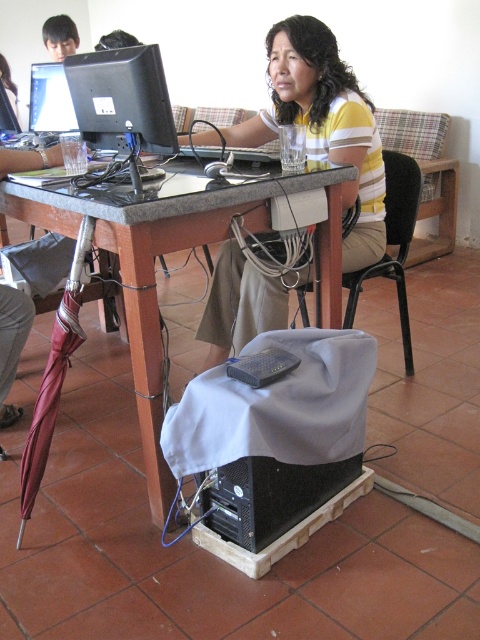
You are a photographer taking a portrait of the woman in the scene. You notice the yellow striped shirt at upper center and the smooth skin face at upper left. Which object should you focus on first to ensure it is in sharp focus if you want the closest object to be clear?

The yellow striped shirt at upper center is closer to the viewer than the smooth skin face at upper left, so you should focus on the yellow striped shirt at upper center first to ensure it is in sharp focus.